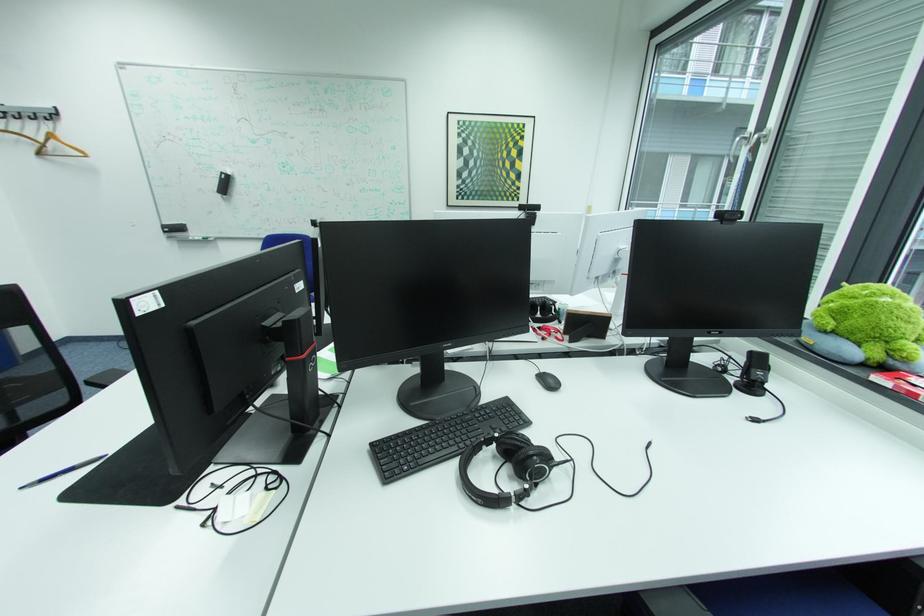
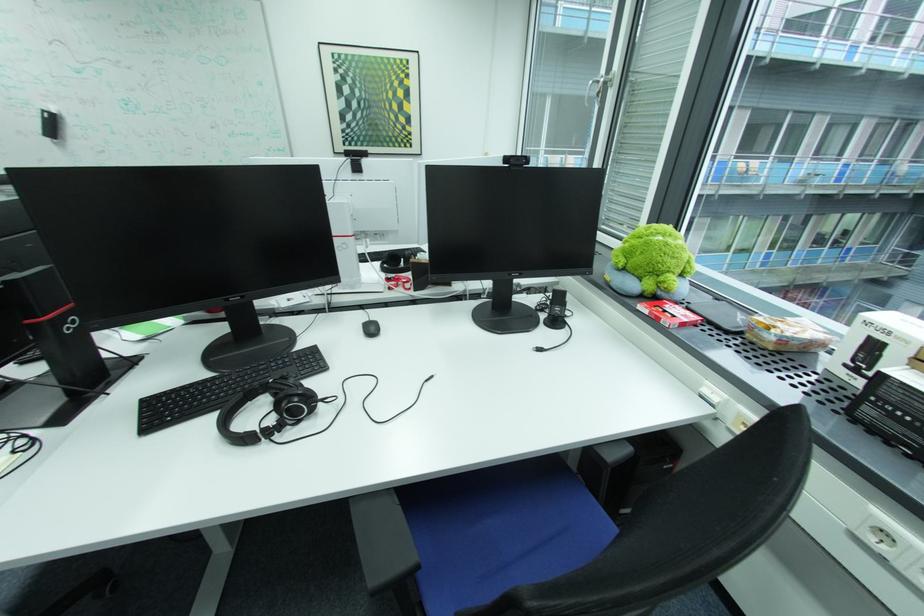
The point at (882, 365) is marked in the first image. Where is the corresponding point in the second image?

(659, 297)